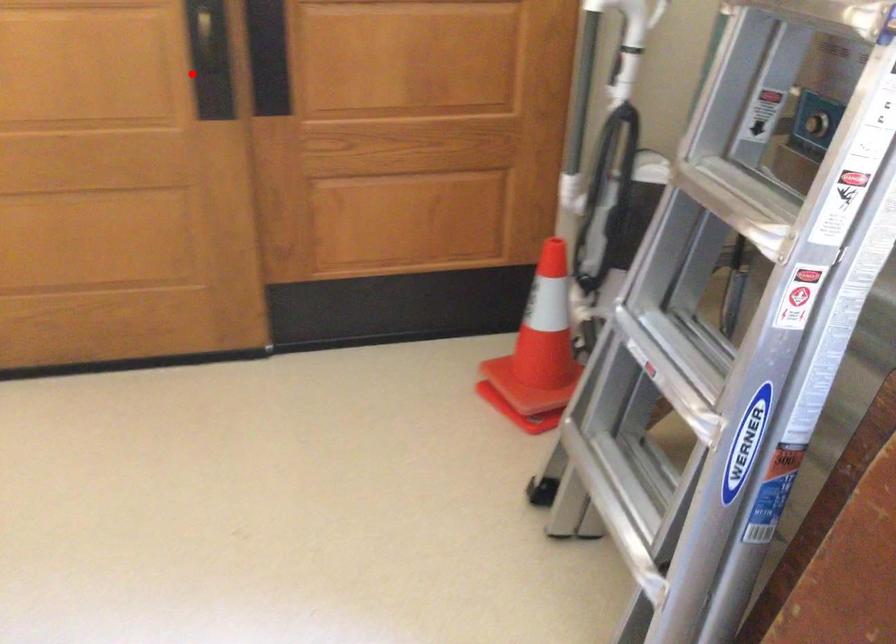
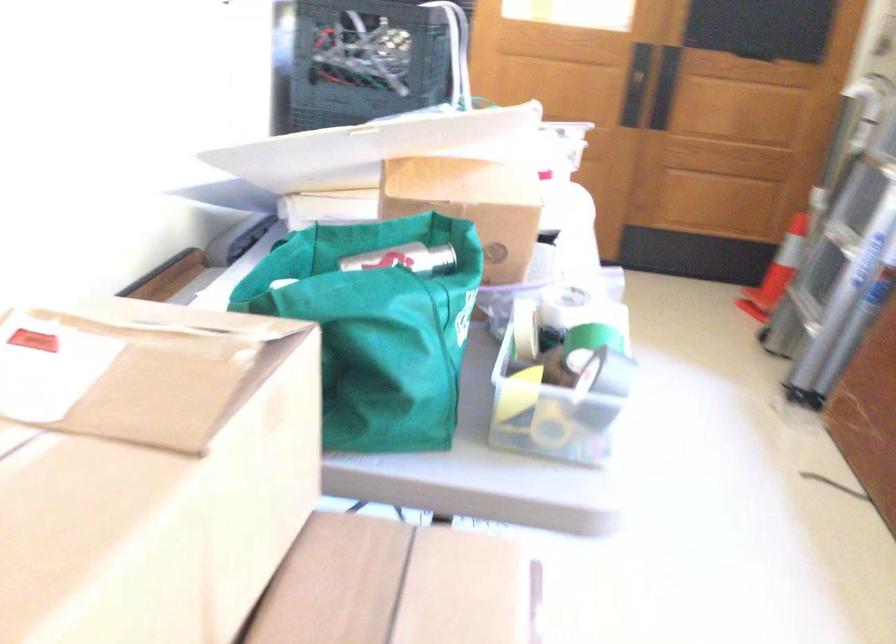
Question: I am providing you with two images of the same scene from different viewpoints. A red point is shown in image1. For the corresponding object point in image2, is it positioned nearer or farther from the camera?

Choices:
 (A) Nearer
 (B) Farther

Answer: (B)